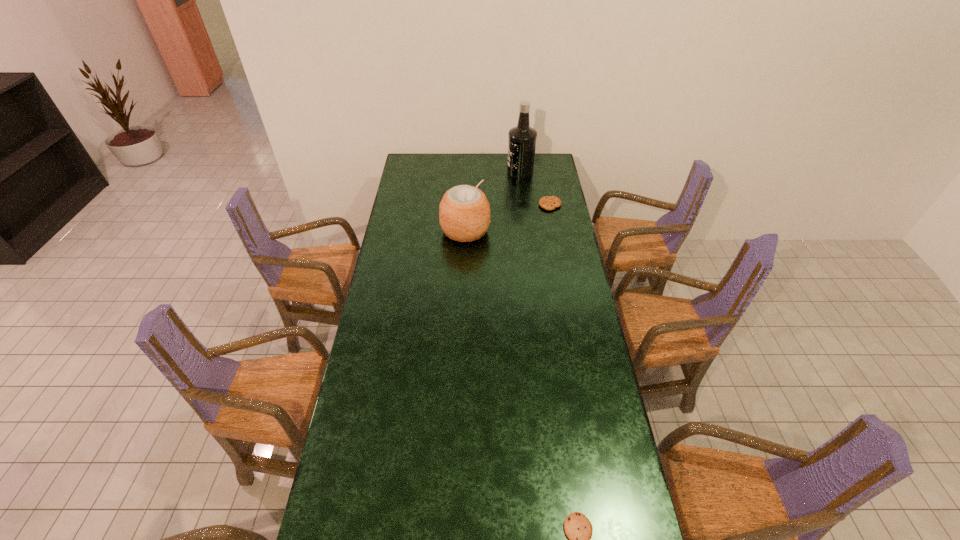
Identify the location of free space between the farther cookie and the leftmost object. This screenshot has width=960, height=540. (508, 218).

This screenshot has height=540, width=960. What are the coordinates of `vacant area that lies between the farthest object and the third farthest object` in the screenshot? It's located at (492, 201).

Identify the location of object identified as the closest to the taller cookie. The width and height of the screenshot is (960, 540). (522, 139).

I want to click on object that can be found as the second closest to the tallest object, so click(464, 212).

The image size is (960, 540). I want to click on free space that satisfies the following two spatial constraints: 1. on the front label of the liquor; 2. on the front side of the third farthest object, so click(527, 231).

You are a GUI agent. You are given a task and a screenshot of the screen. Output one action in this format:
    pyautogui.click(x=<x>, y=<y>)
    Task: Click on the free space in the image that satisfies the following two spatial constraints: 1. on the front label of the second shortest object; 2. on the left side of the farthest object
    The width and height of the screenshot is (960, 540).
    Given the screenshot: What is the action you would take?
    pyautogui.click(x=524, y=205)

Locate an element on the screen. The height and width of the screenshot is (540, 960). free point that satisfies the following two spatial constraints: 1. on the back side of the third farthest object; 2. on the right side of the taller cookie is located at coordinates (467, 205).